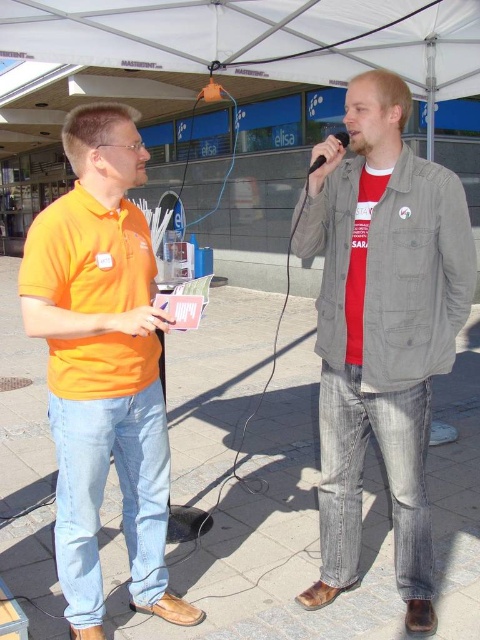
Question: Does red cotton t-shirt at center have a smaller size compared to black matte microphone at center?

Choices:
 (A) yes
 (B) no

Answer: (B)

Question: Which of the following is the farthest from the observer?

Choices:
 (A) orange cotton shirt at left
 (B) black matte microphone at center
 (C) white fabric canopy at upper center

Answer: (C)

Question: Is red cotton t-shirt at center behind white fabric canopy at upper center?

Choices:
 (A) no
 (B) yes

Answer: (A)

Question: Estimate the real-world distances between objects in this image. Which object is closer to the black matte microphone at center?

Choices:
 (A) red cotton t-shirt at center
 (B) white fabric canopy at upper center

Answer: (A)

Question: Does orange cotton shirt at left have a larger size compared to black matte microphone at center?

Choices:
 (A) yes
 (B) no

Answer: (A)

Question: Among these points, which one is farthest from the camera?

Choices:
 (A) (267, 38)
 (B) (348, 509)
 (C) (142, 385)
 (D) (335, 138)

Answer: (A)